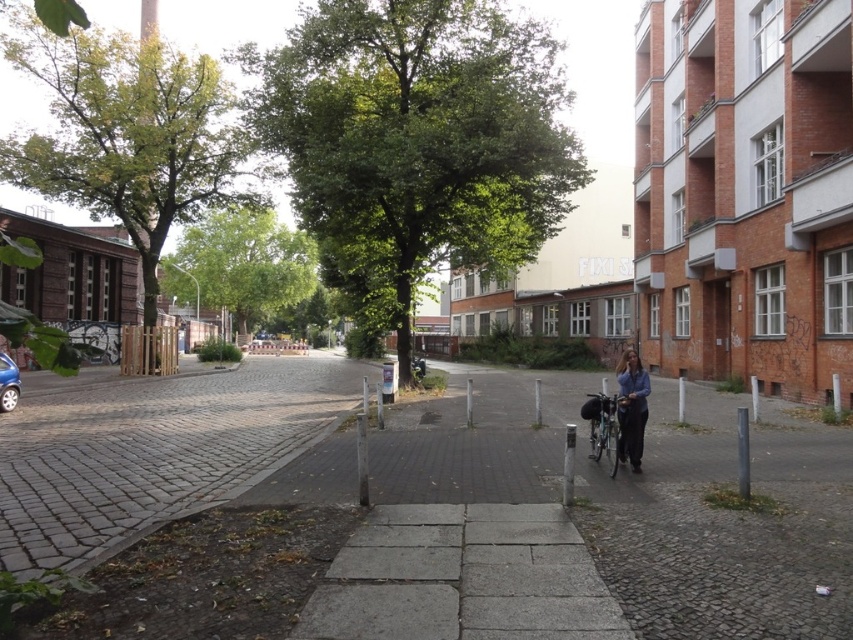
You are navigating an urban area and need to reach a destination directly across the gray concrete pavement at center. Given that the coordinates of the pavement are at point 0.792, 0.513, can you determine if you should adjust your path to avoid obstacles?

The gray concrete pavement at center is located at point (437, 506). Since the coordinates indicate its position, you should plan your route accordingly to ensure you reach the destination without obstacles.